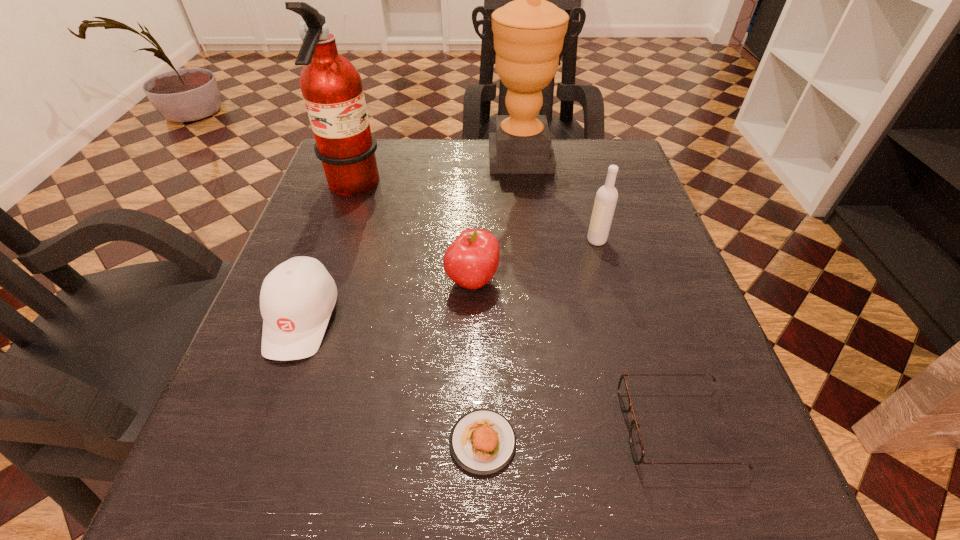
Identify the location of food present at the near edge. The image size is (960, 540). (482, 441).

Identify the location of fire extinguisher that is at the left edge. (331, 86).

Locate an element on the screen. baseball cap that is at the left edge is located at coordinates (297, 297).

At what (x,y) coordinates should I click in order to perform the action: click on award that is at the right edge. Please return your answer as a coordinate pair (x, y). Looking at the image, I should click on (529, 32).

The width and height of the screenshot is (960, 540). In order to click on vodka located at the right edge in this screenshot , I will do pyautogui.click(x=606, y=197).

Find the location of a particular element. This screenshot has width=960, height=540. sunglasses located in the right edge section of the desktop is located at coordinates (636, 445).

At what (x,y) coordinates should I click in order to perform the action: click on object that is at the far left corner. Please return your answer as a coordinate pair (x, y). Looking at the image, I should click on (331, 86).

At what (x,y) coordinates should I click in order to perform the action: click on object at the far right corner. Please return your answer as a coordinate pair (x, y). Looking at the image, I should click on (529, 32).

This screenshot has width=960, height=540. What are the coordinates of `object present at the near right corner` in the screenshot? It's located at (636, 445).

Where is `vacant region at the far edge of the desktop`? vacant region at the far edge of the desktop is located at coordinates (437, 170).